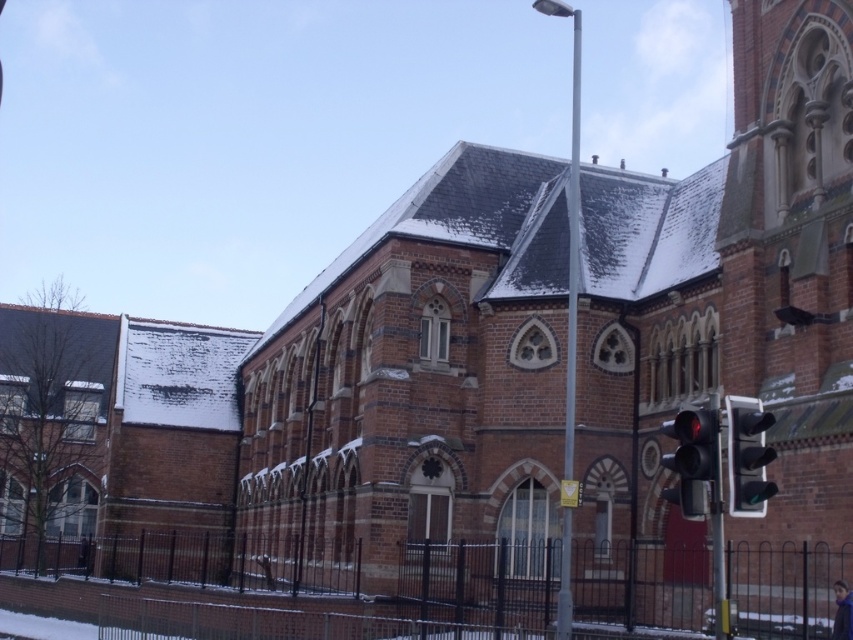
Is point (675, 424) closer to viewer compared to point (734, 513)?

No, it is not.

What do you see at coordinates (693, 461) in the screenshot? The width and height of the screenshot is (853, 640). I see `red glass traffic light at lower right` at bounding box center [693, 461].

Between point (688, 416) and point (746, 422), which one is positioned in front?

Point (746, 422) is in front.

Find the location of a particular element. red glass traffic light at lower right is located at coordinates (693, 461).